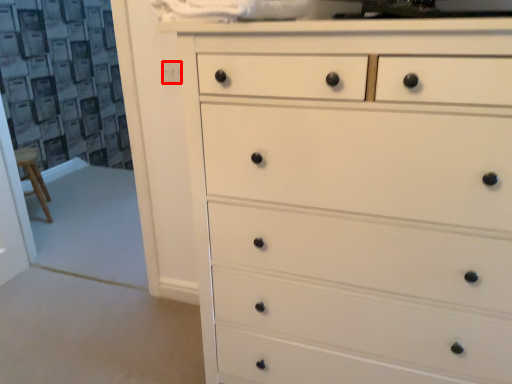
Question: Where is knob (annotated by the red box) located in relation to chest of drawers in the image?

Choices:
 (A) left
 (B) right

Answer: (A)